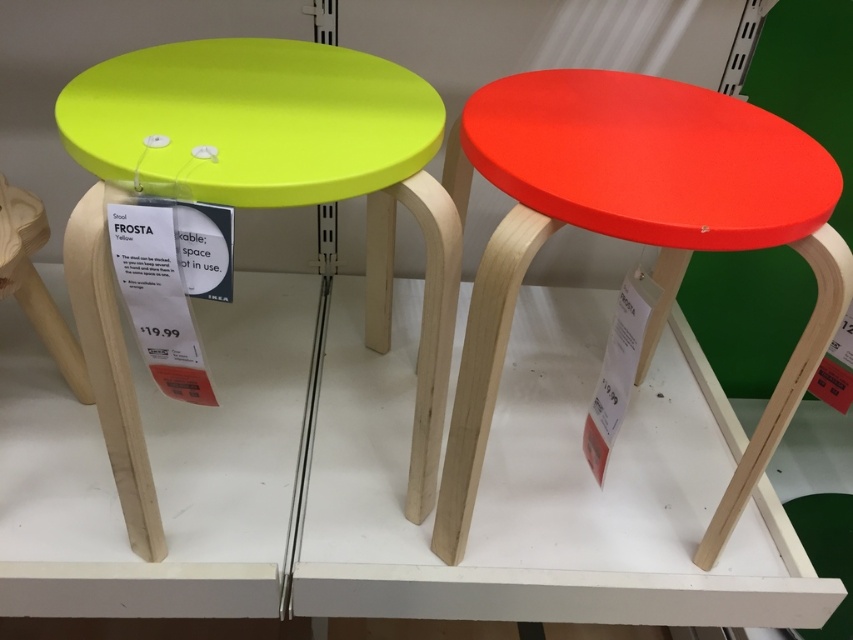
You are arranging items on a shelf in a store and need to place a new item between the matte yellow stool at left and the matte red stool at right. The new item requires at least 10 inches of space. Based on the current spacing between the two stools, will there be enough room?

The distance between the matte yellow stool at left and the matte red stool at right is 8.29 inches, which is less than the required 10 inches. Therefore, there isn not enough space to place the new item between them.

You are organizing a store display and need to place a new decorative item between the matte yellow stool at left and the matte red stool at right. Based on their current positions, where should you place the item to ensure it is centered between them?

The matte yellow stool at left is positioned on the left side of the matte red stool at right, so placing the decorative item exactly halfway between them would center it between the two stools.